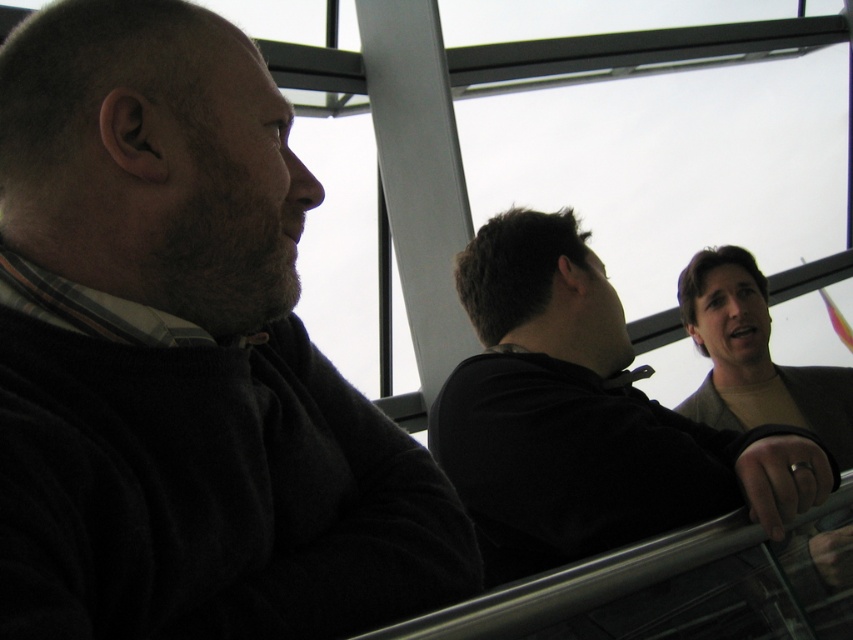
Question: Is dark gray hoodie at upper right wider than matte brown shirt at right?

Choices:
 (A) no
 (B) yes

Answer: (A)

Question: Which point is farther to the camera?

Choices:
 (A) dark gray hoodie at upper right
 (B) matte brown shirt at right

Answer: (B)

Question: Which point appears closest to the camera in this image?

Choices:
 (A) (555, 323)
 (B) (234, 211)

Answer: (B)

Question: Which object is positioned closest to the dark matte sweater at left?

Choices:
 (A) matte brown shirt at right
 (B) dark gray hoodie at upper right

Answer: (B)

Question: Does dark matte sweater at left have a greater width compared to dark gray hoodie at upper right?

Choices:
 (A) no
 (B) yes

Answer: (A)

Question: Can you confirm if dark matte sweater at left is smaller than dark gray hoodie at upper right?

Choices:
 (A) no
 (B) yes

Answer: (B)